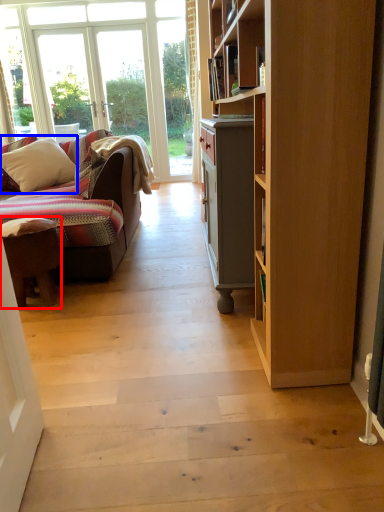
Question: Which point is closer to the camera, desk (highlighted by a red box) or pillow (highlighted by a blue box)?

Choices:
 (A) desk
 (B) pillow

Answer: (A)